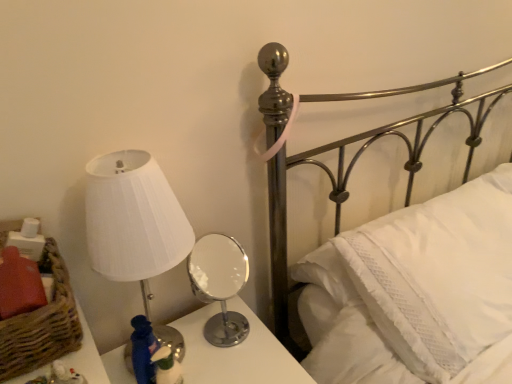
I want to click on free point above brown woven basket at lower left (from a real-world perspective), so click(x=35, y=291).